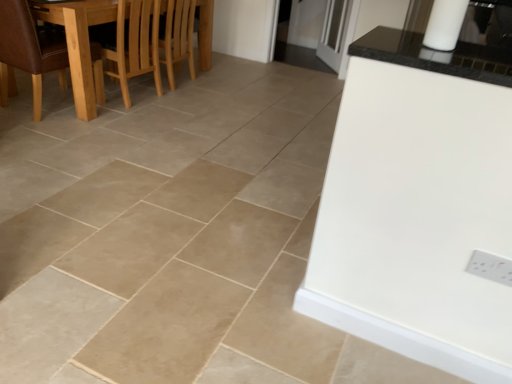
Find the location of a particular element. free spot to the right of brown leather chair at left is located at coordinates (122, 116).